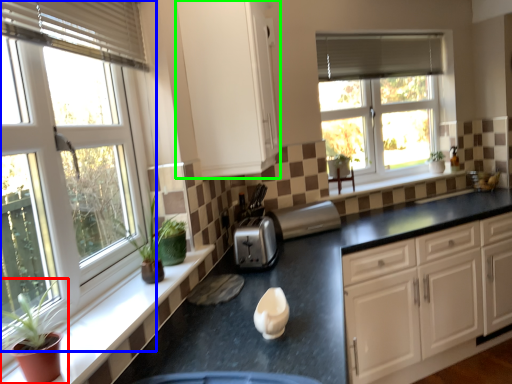
Question: Based on their relative distances, which object is farther from houseplant (highlighted by a red box)? Choose from window (highlighted by a blue box) and cabinetry (highlighted by a green box).

Choices:
 (A) window
 (B) cabinetry

Answer: (B)